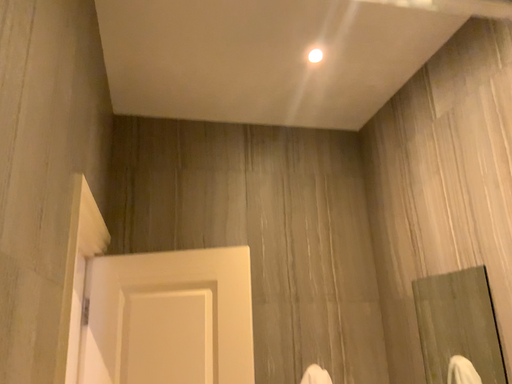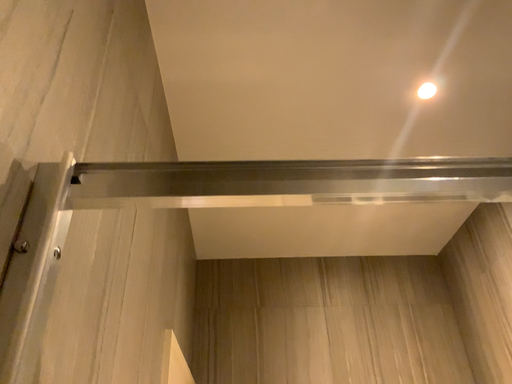
Question: How did the camera likely rotate when shooting the video?

Choices:
 (A) rotated downward
 (B) rotated upward

Answer: (B)